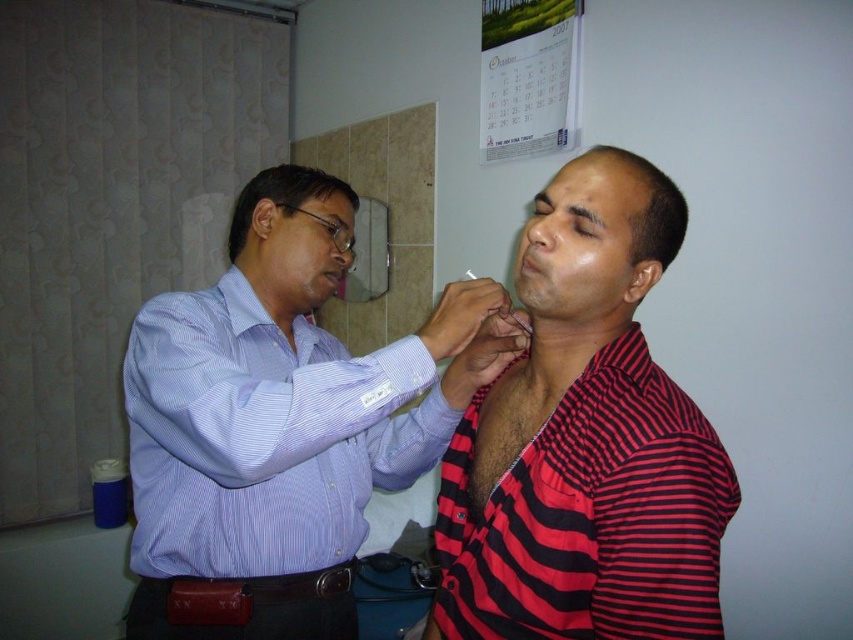
You are a medical assistant who needs to pass a tool to the doctor wearing the blue striped shirt at upper left. The tool is currently on a tray near the red striped shirt at center. Can you reach the tray from your current position without moving closer? The maximum reach of your arm is 8 inches.

The distance between the blue striped shirt at upper left and the red striped shirt at center is 8.65 inches. Since your maximum reach is 8 inches, you cannot reach the tray without moving closer.

You are a medical assistant in the room. You need to hand a tool to the person in the red striped shirt at center. Which direction should you walk from the blue striped shirt at upper left to reach them?

The blue striped shirt at upper left is to the left of the red striped shirt at center. So you should walk to the right from the blue striped shirt at upper left to reach the red striped shirt at center.

You are a medical student observing a procedure in a clinic. You notice two shirts in the scene. Which shirt is taller, the blue striped shirt at upper left or the red striped shirt at center?

The blue striped shirt at upper left is taller than the red striped shirt at center according to the description.